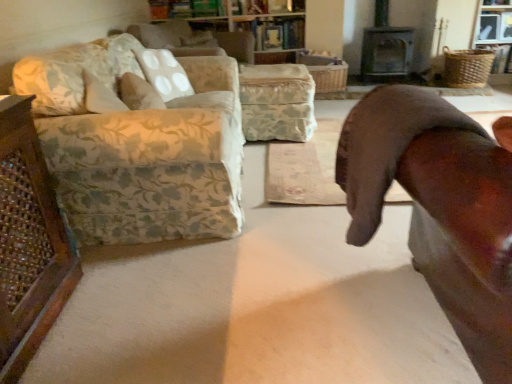
Image resolution: width=512 pixels, height=384 pixels. In order to click on vacant region to the left of brown leather chair at right in this screenshot , I will do `click(257, 308)`.